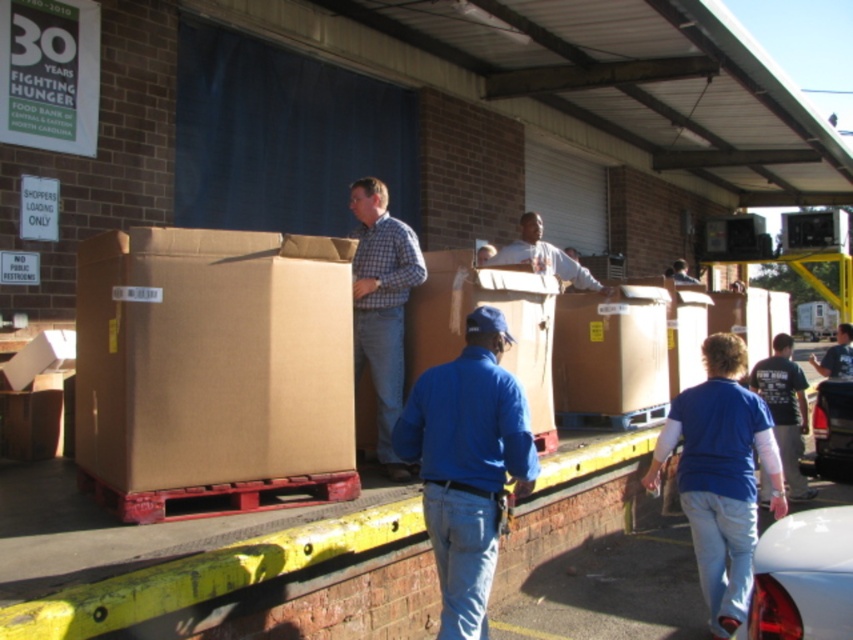
Looking at this image, you are a delivery driver who just arrived at the Food Bank of Central and Eastern North Carolina. You need to unload boxes from your shiny white car at lower right and place them onto the pallets. Considering the height difference between your car and the blue shirt at center, will you need a step stool to reach the boxes in the backseat?

The shiny white car at lower right has a lesser height compared to the blue shirt at center. Since the car is shorter, you might need a step stool to reach the backseat boxes comfortably.